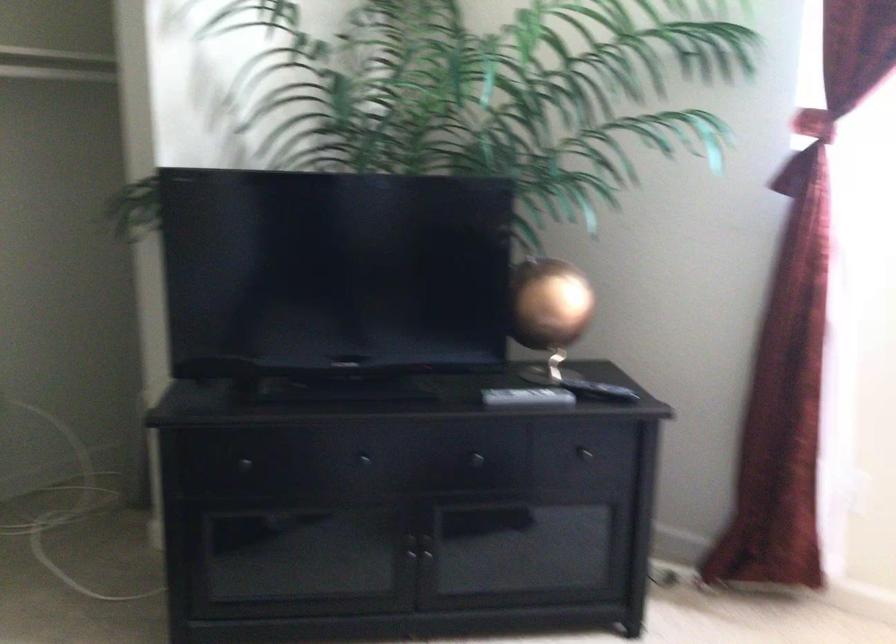
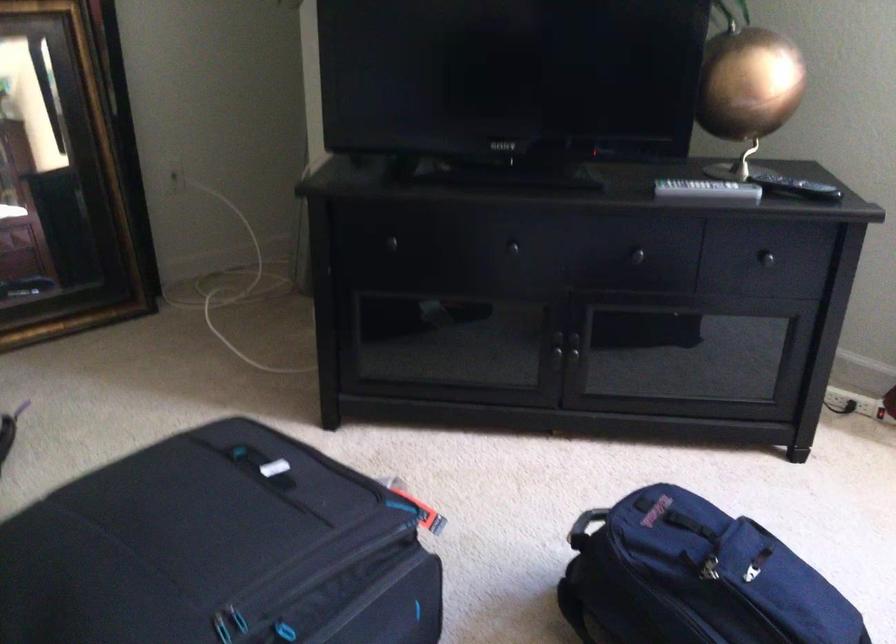
The point at (426, 550) is marked in the first image. Where is the corresponding point in the second image?

(574, 351)